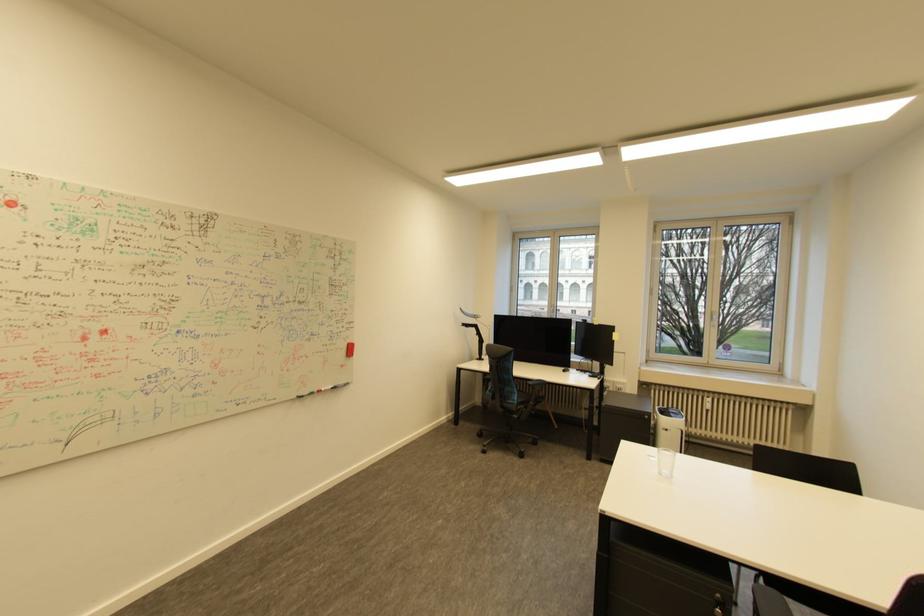
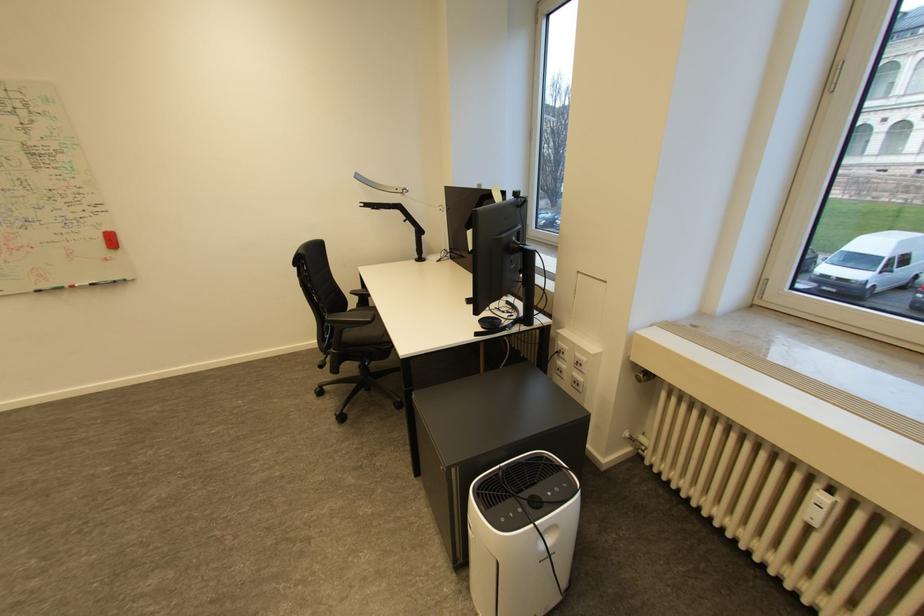
The point at (330, 390) is marked in the first image. Where is the corresponding point in the second image?

(83, 286)